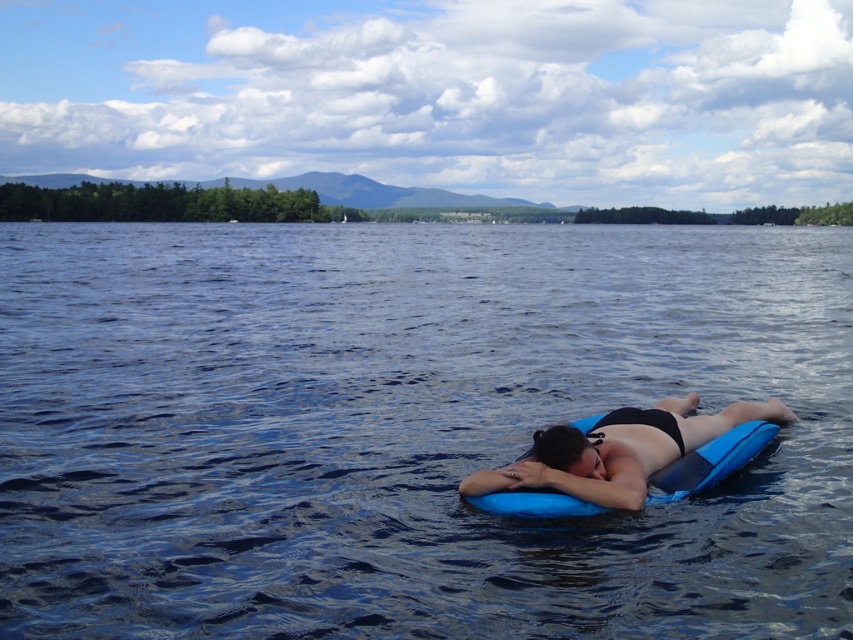
Question: Can you confirm if blue rubber mat at center is wider than matte blue foam at center?

Choices:
 (A) yes
 (B) no

Answer: (A)

Question: Which point is closer to the camera?

Choices:
 (A) blue rubber mat at center
 (B) matte blue foam at center

Answer: (A)

Question: Which of the following is the farthest from the observer?

Choices:
 (A) matte blue foam at center
 (B) blue rubber mat at center

Answer: (A)

Question: Observing the image, what is the correct spatial positioning of blue rubber mat at center in reference to matte blue foam at center?

Choices:
 (A) below
 (B) above

Answer: (B)

Question: Among these points, which one is nearest to the camera?

Choices:
 (A) (784, 627)
 (B) (544, 470)

Answer: (A)

Question: Does blue rubber mat at center have a greater width compared to matte blue foam at center?

Choices:
 (A) no
 (B) yes

Answer: (B)